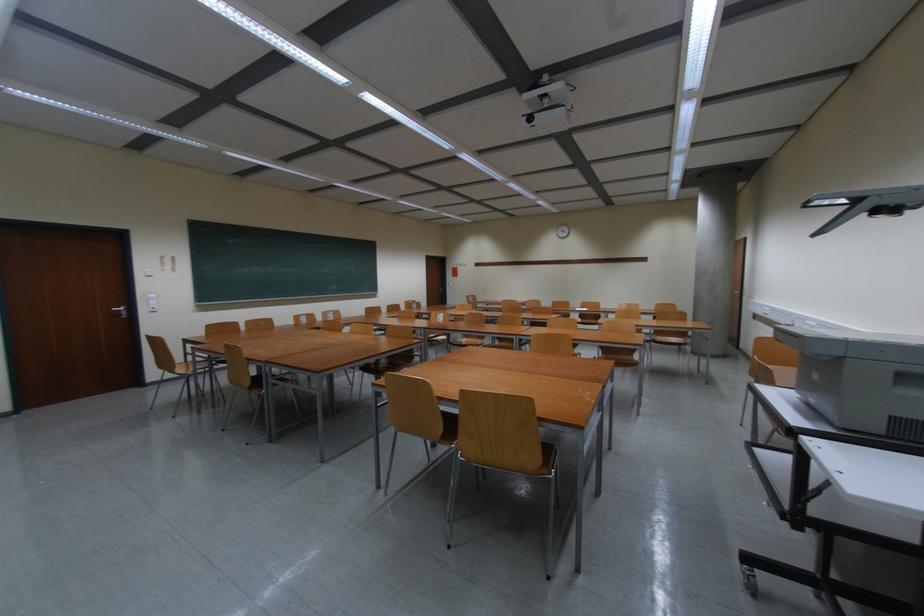
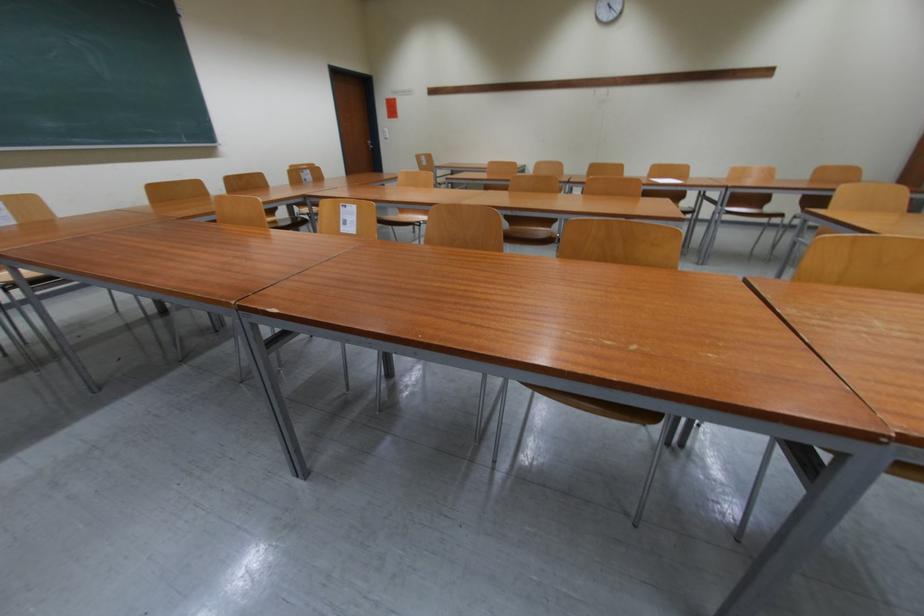
Question: What movement of the cameraman would produce the second image?

Choices:
 (A) Left
 (B) Right
 (C) Forward
 (D) Backward

Answer: (C)